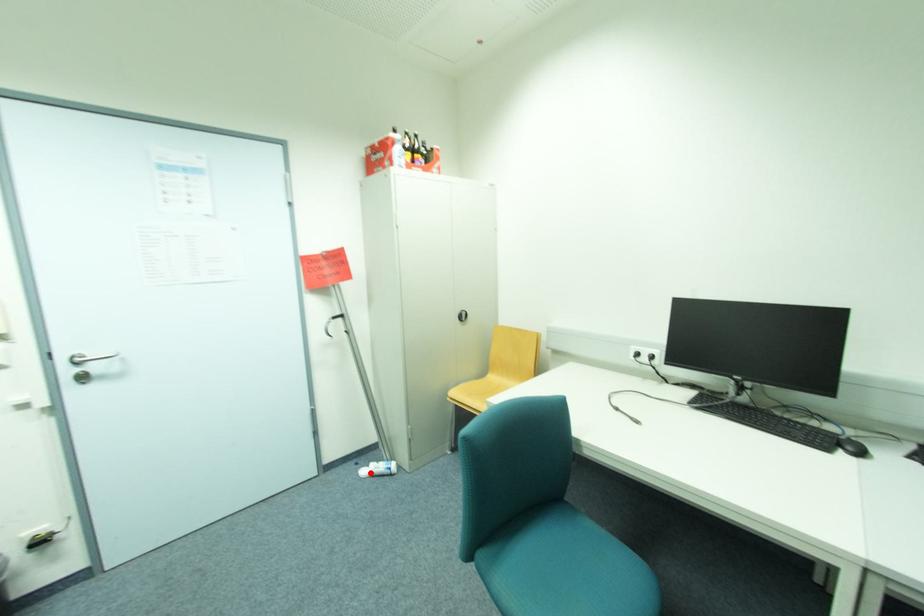
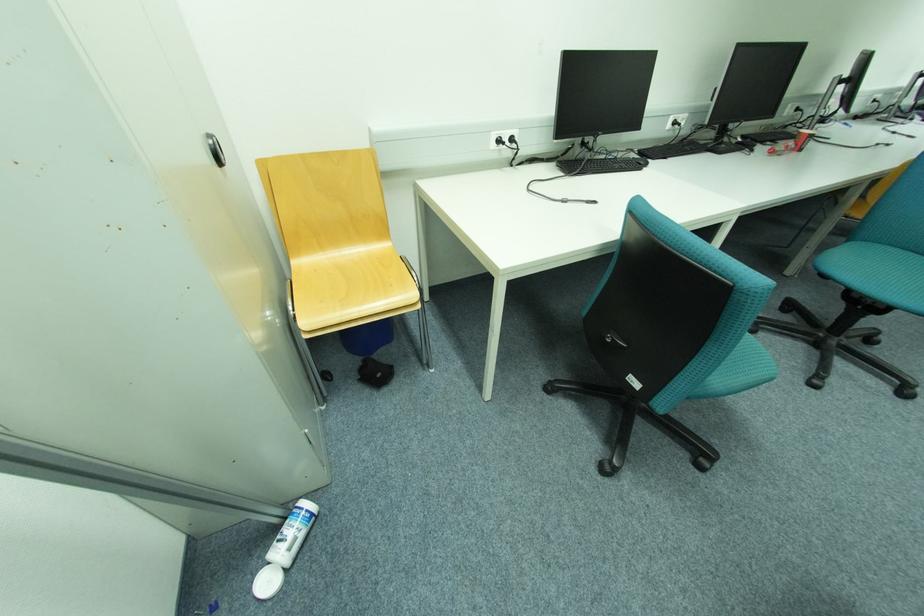
Question: A red point is marked in image1. In image2, is the corresponding 3D point closer to the camera or farther? Reply with the corresponding letter.

Choices:
 (A) The corresponding 3D point is closer.
 (B) The corresponding 3D point is farther.

Answer: (A)